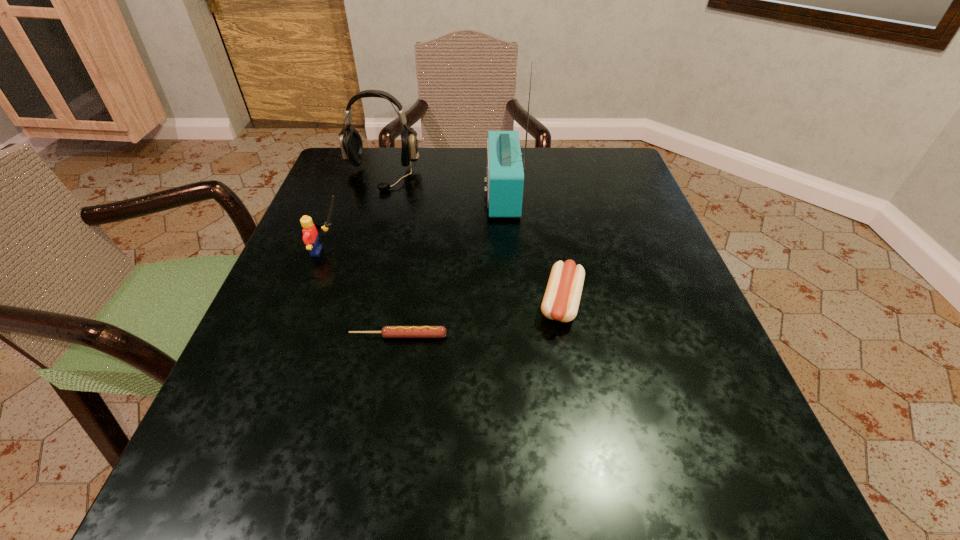
You are a GUI agent. You are given a task and a screenshot of the screen. Output one action in this format:
    pyautogui.click(x=<x>, y=<y>)
    Task: Click on the blank space located 0.180m on the front panel of the tallest object
    This screenshot has width=960, height=540.
    Given the screenshot: What is the action you would take?
    pyautogui.click(x=404, y=194)

Locate an element on the screen. The height and width of the screenshot is (540, 960). vacant space located on the front panel of the tallest object is located at coordinates pyautogui.click(x=321, y=194).

This screenshot has height=540, width=960. Identify the location of vacant space situated with the microphone on the side of the second tallest object. (334, 332).

Locate an element on the screen. The image size is (960, 540). vacant region located on the front-facing side of the Lego is located at coordinates (500, 251).

Locate an element on the screen. This screenshot has height=540, width=960. free space located on the front of the right sausage is located at coordinates (572, 360).

This screenshot has width=960, height=540. In order to click on blank space located 0.080m on the left of the left sausage in this screenshot , I will do `click(300, 336)`.

You are a GUI agent. You are given a task and a screenshot of the screen. Output one action in this format:
    pyautogui.click(x=<x>, y=<y>)
    Task: Click on the radio receiver that is at the far edge
    
    Given the screenshot: What is the action you would take?
    pyautogui.click(x=505, y=176)

Locate an element on the screen. headset situated at the far edge is located at coordinates tap(351, 145).

You are a GUI agent. You are given a task and a screenshot of the screen. Output one action in this format:
    pyautogui.click(x=<x>, y=<y>)
    Task: Click on the headset that is positioned at the left edge
    
    Given the screenshot: What is the action you would take?
    pyautogui.click(x=351, y=145)

Find the location of a particular element. This screenshot has width=960, height=540. Lego that is at the left edge is located at coordinates (310, 237).